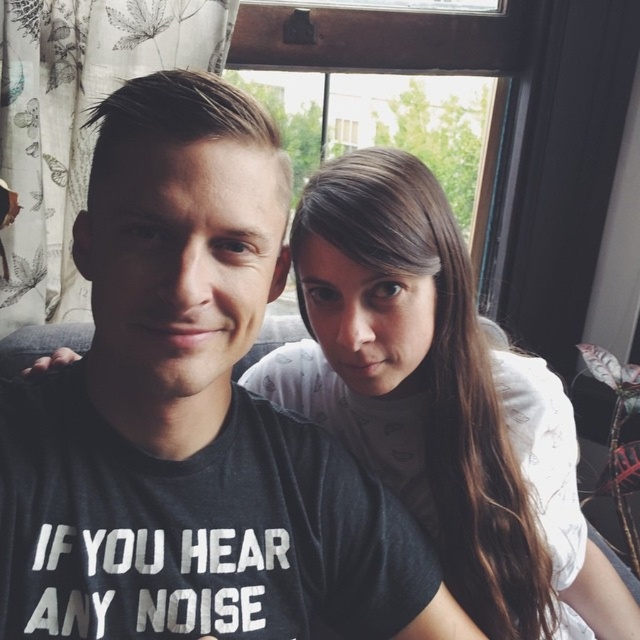
You are standing in the room and want to place a small plant exactly at the point marked as point (214, 312). If your hand is currently 50 centimeters away from that point, can you adjust your hand to reach it without moving your feet?

The distance between you and point (214, 312) is 48.39 centimeters. Since your hand is 50 centimeters away, you can move your hand closer by approximately 1.61 centimeters to reach the point without needing to move your feet.

You are taking a photo of two people sitting near a window. You want to focus on the person closer to the camera. Which point should you focus on, point (211, 404) or point (344, 288)?

You should focus on point (211, 404) because it is closer to the camera than point (344, 288).